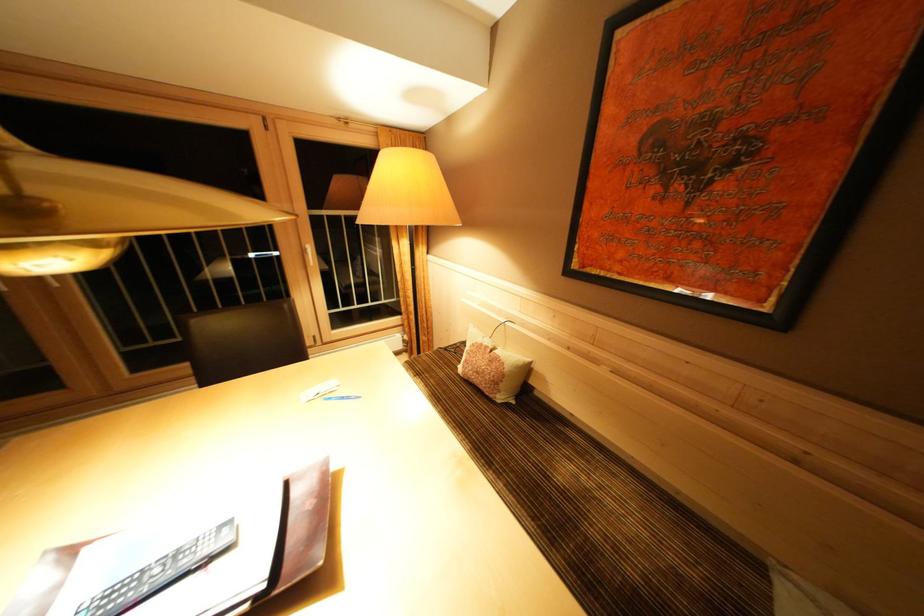
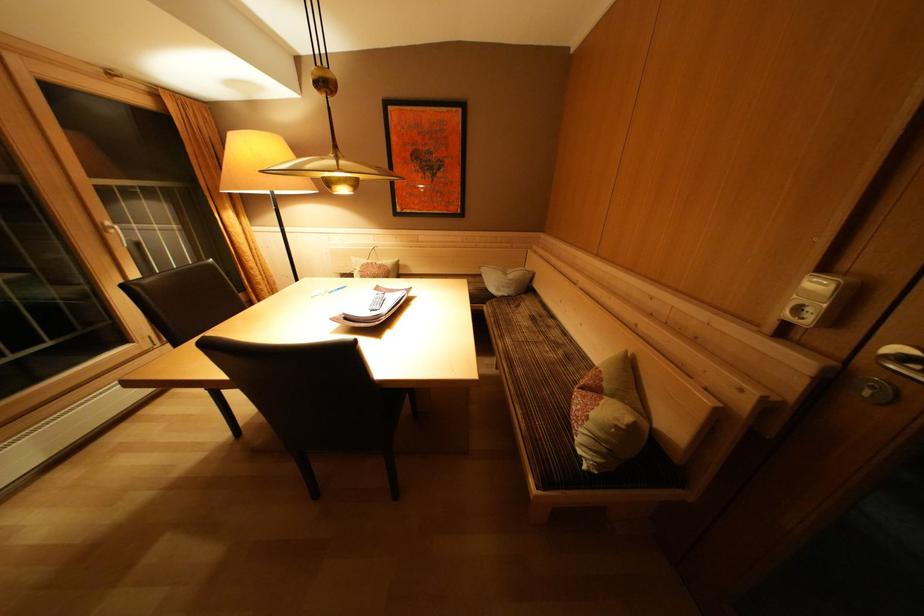
The point at (493, 352) is marked in the first image. Where is the corresponding point in the second image?

(379, 268)